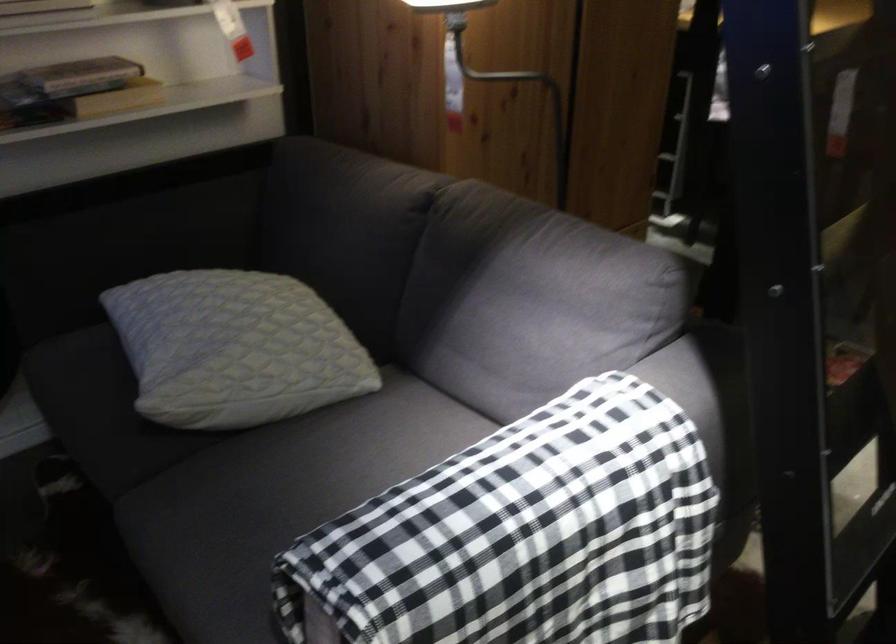
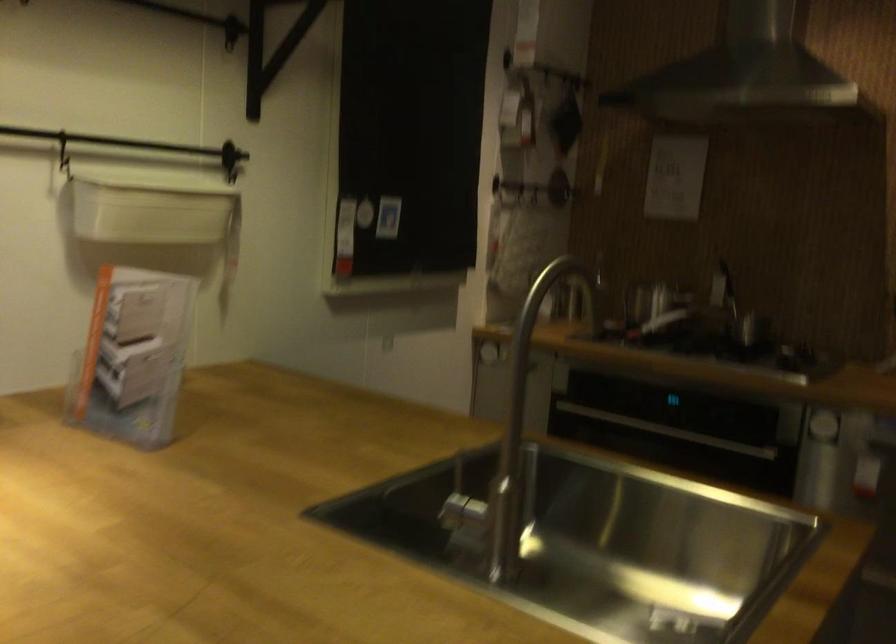
The images are taken continuously from a first-person perspective. In which direction are you moving?

The cameraman walked toward right, forward.